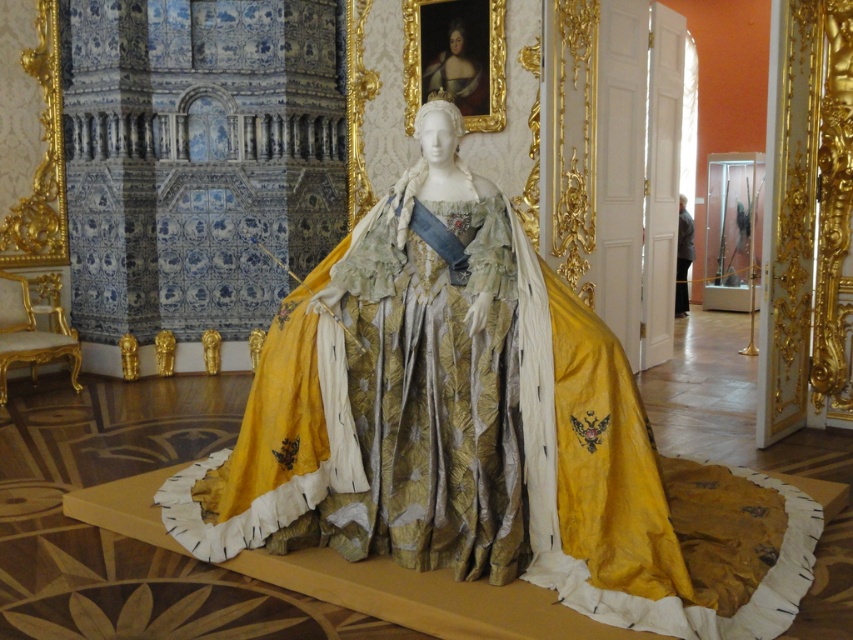
Question: Is the position of smooth gold crown at upper center less distant than that of gold satin gown at center?

Choices:
 (A) no
 (B) yes

Answer: (B)

Question: Which point is farther to the camera?

Choices:
 (A) smooth gold crown at upper center
 (B) gold satin gown at center

Answer: (B)

Question: Does smooth gold crown at upper center have a smaller size compared to gold satin gown at center?

Choices:
 (A) no
 (B) yes

Answer: (B)

Question: Which of the following is the farthest from the observer?

Choices:
 (A) (450, 64)
 (B) (689, 214)

Answer: (B)

Question: Is the position of smooth gold crown at upper center less distant than that of gold satin gown at center?

Choices:
 (A) no
 (B) yes

Answer: (B)